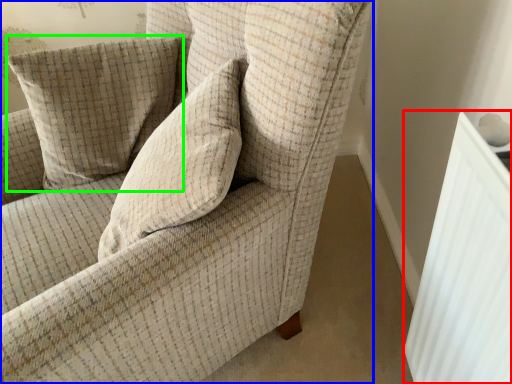
Question: Based on their relative distances, which object is nearer to radiator (highlighted by a red box)? Choose from chair (highlighted by a blue box) and pillow (highlighted by a green box).

Choices:
 (A) chair
 (B) pillow

Answer: (A)